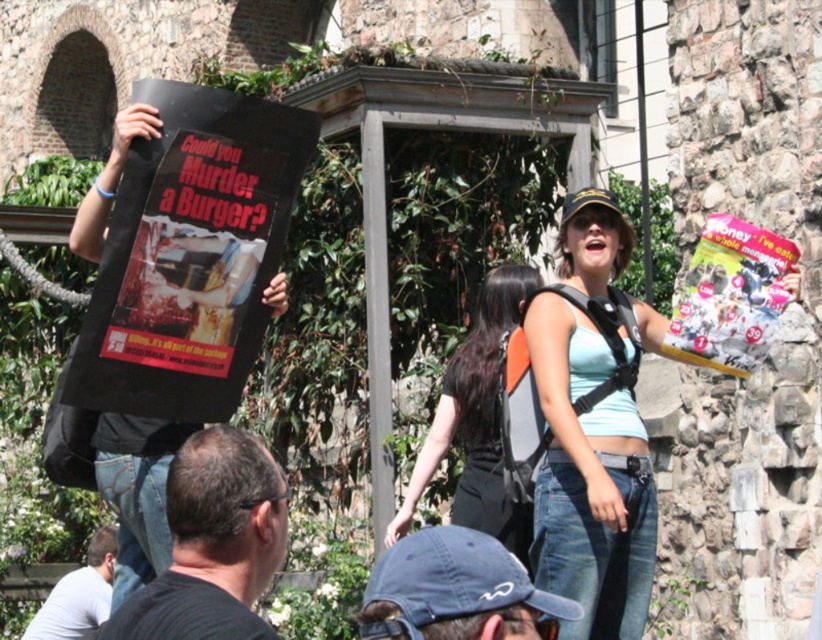
What is located at the coordinates point (x=593, y=428) in the image?

The point (x=593, y=428) marks light blue denim jeans at center.

You are a photographer trying to capture a closeup of the denim cap at lower center and the light gray shirt at lower left. Which object should you zoom in on to ensure both are visible in the frame without cropping?

The denim cap at lower center occupies less space than the light gray shirt at lower left, so you should zoom in on the light gray shirt at lower left to ensure both are visible without cropping.